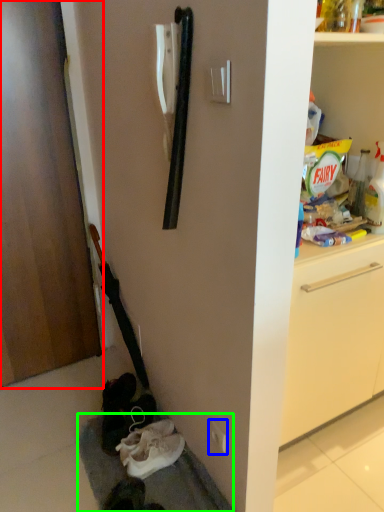
Question: Which is farther away from door (highlighted by a red box)? electric outlet (highlighted by a blue box) or gray (highlighted by a green box)?

Choices:
 (A) electric outlet
 (B) gray

Answer: (A)